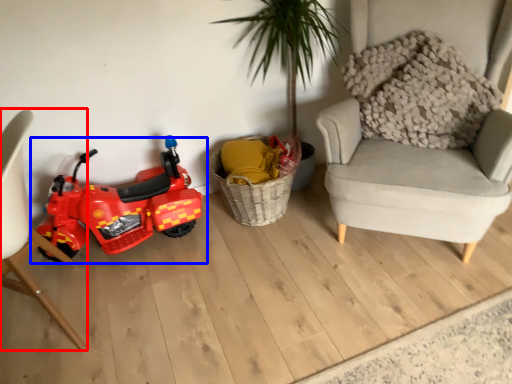
Question: Among these objects, which one is nearest to the camera, chair (highlighted by a red box) or land vehicle (highlighted by a blue box)?

Choices:
 (A) chair
 (B) land vehicle

Answer: (A)